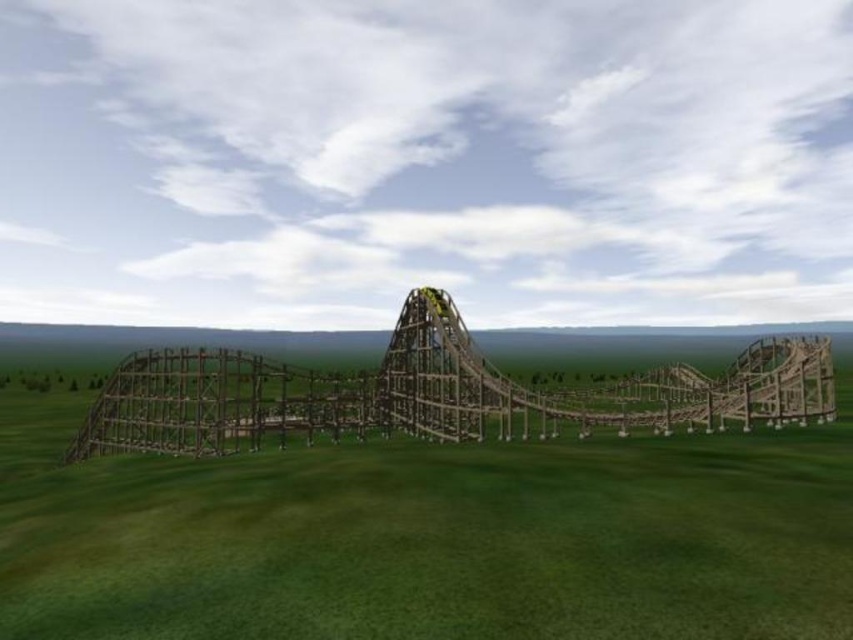
You are an engineer inspecting the construction site of a new roller coaster. You notice the green grassy at center and the brown wooden roller coaster at center. Can you determine if the grassy area is elevated compared to the roller coaster structure?

The green grassy at center is located above the brown wooden roller coaster at center, so the grassy area is elevated compared to the roller coaster structure.

You are standing at the origin point of the coordinate system in the image. You want to walk towards the green grassy at center. In which direction should you move based on the coordinate system?

The green grassy at center is located at point (428,536) in the 2D coordinate system. Since the x and y coordinates are both positive, you should move towards the right and forward direction to reach it.

You are standing at the edge of the grassy field and see the green grassy at center and the brown wooden roller coaster at center. Which object is located to the right side of the other?

The green grassy at center is to the right of the brown wooden roller coaster at center.